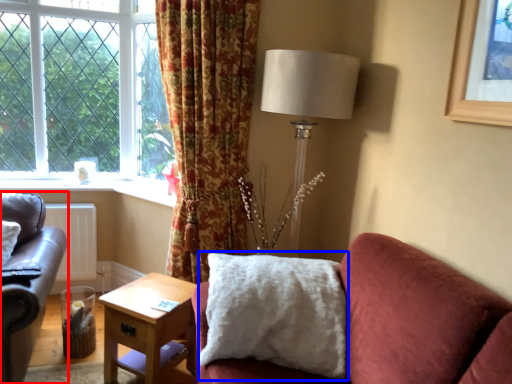
Question: Among these objects, which one is farthest to the camera, studio couch (highlighted by a red box) or pillow (highlighted by a blue box)?

Choices:
 (A) studio couch
 (B) pillow

Answer: (B)